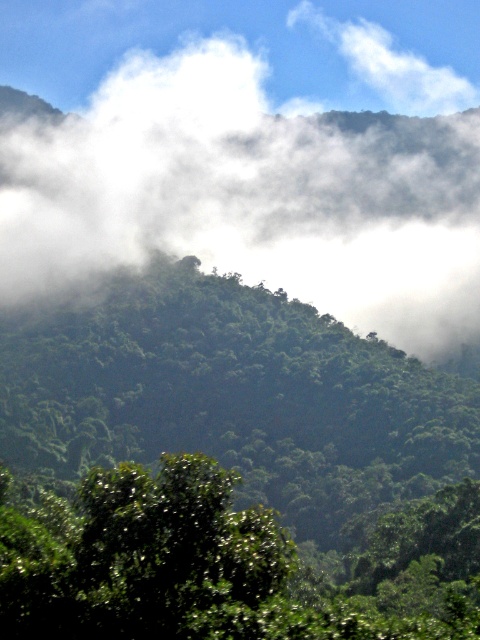
Does green leafy tree at center come behind white fluffy fog at upper center?

No, green leafy tree at center is closer to the viewer.

Between green leafy tree at center and white fluffy fog at upper center, which one appears on the right side from the viewer's perspective?

From the viewer's perspective, green leafy tree at center appears more on the right side.

Which is in front, point (162, 570) or point (60, 196)?

Point (162, 570) is more forward.

The width and height of the screenshot is (480, 640). In order to click on green leafy tree at center in this screenshot , I will do `click(229, 470)`.